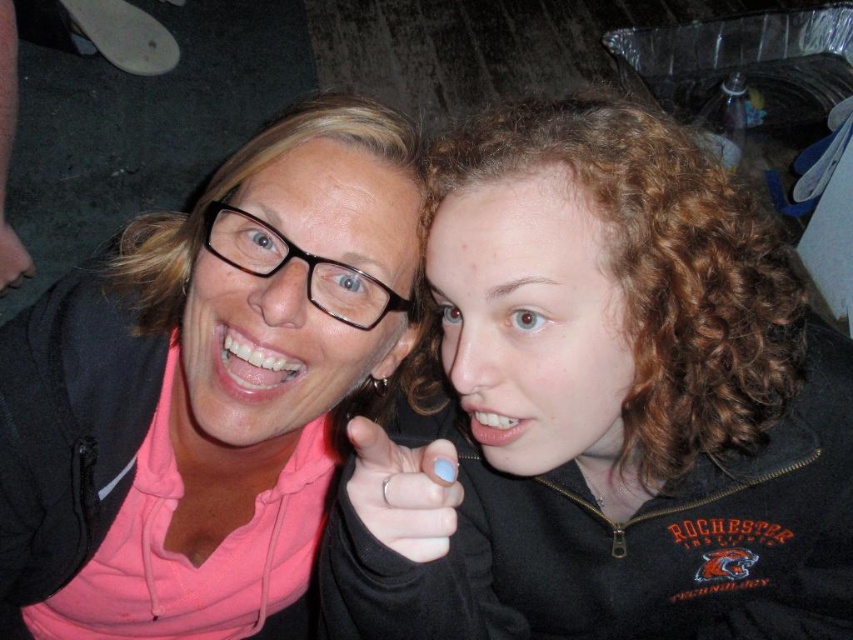
Between point (427, 502) and point (16, 253), which one is positioned behind?

The point (16, 253) is behind.

Can you confirm if blue matte nail polish at center is thinner than matte black hand at lower left?

Indeed, blue matte nail polish at center has a lesser width compared to matte black hand at lower left.

Where is `blue matte nail polish at center`? blue matte nail polish at center is located at coordinates [403, 492].

Is point (720, 352) closer to camera compared to point (451, 445)?

No, (720, 352) is further to viewer.

Is matte black jacket at center taller than blue matte nail polish at center?

Yes, matte black jacket at center is taller than blue matte nail polish at center.

Who is more distant from viewer, (703, 182) or (351, 476)?

Point (703, 182)

The height and width of the screenshot is (640, 853). Identify the location of matte black jacket at center. click(601, 406).

Is pink matte hoodie at upper left to the left of matte black hand at lower left from the viewer's perspective?

Incorrect, pink matte hoodie at upper left is not on the left side of matte black hand at lower left.

Which is below, pink matte hoodie at upper left or matte black hand at lower left?

pink matte hoodie at upper left

Does point (412, 284) come behind point (22, 273)?

No, it is in front of (22, 273).

Locate an element on the screen. This screenshot has width=853, height=640. pink matte hoodie at upper left is located at coordinates (206, 390).